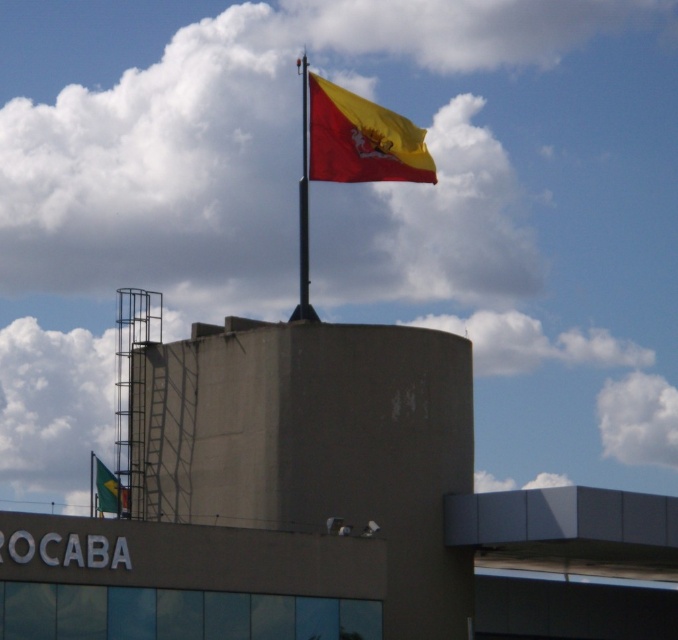
You are a drone operator tasked with flying a drone between the yellow matte flag at upper center and the green fabric flag at lower left. The drone has a maximum flight distance of 25 meters. Can the drone safely complete this flight without exceeding its range?

The distance between the yellow matte flag at upper center and the green fabric flag at lower left is 26.43 meters, which exceeds the drone operator maximum flight distance of 25 meters. The drone cannot safely complete this flight without exceeding its range.